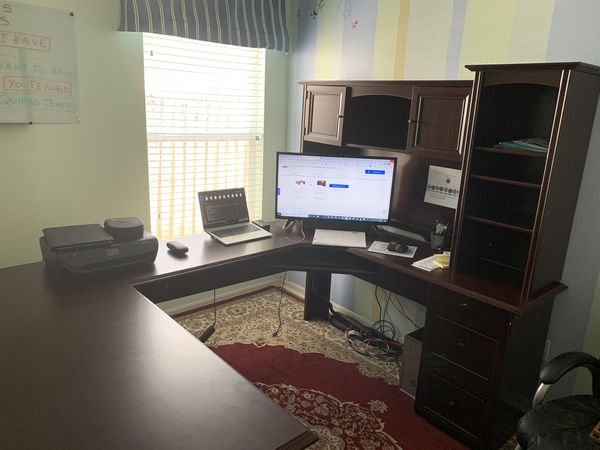
Where is `wooden door`? This screenshot has height=450, width=600. wooden door is located at coordinates (326, 109).